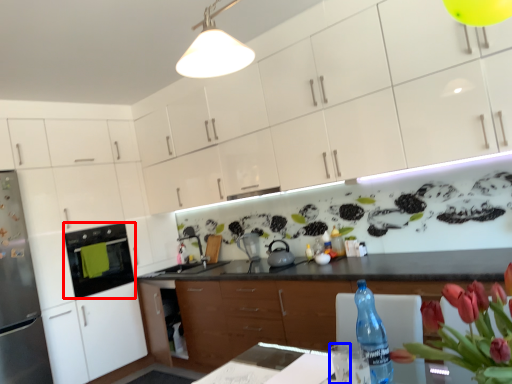
Question: Which object is further to the camera taking this photo, kitchen appliance (highlighted by a red box) or water (highlighted by a blue box)?

Choices:
 (A) kitchen appliance
 (B) water

Answer: (A)